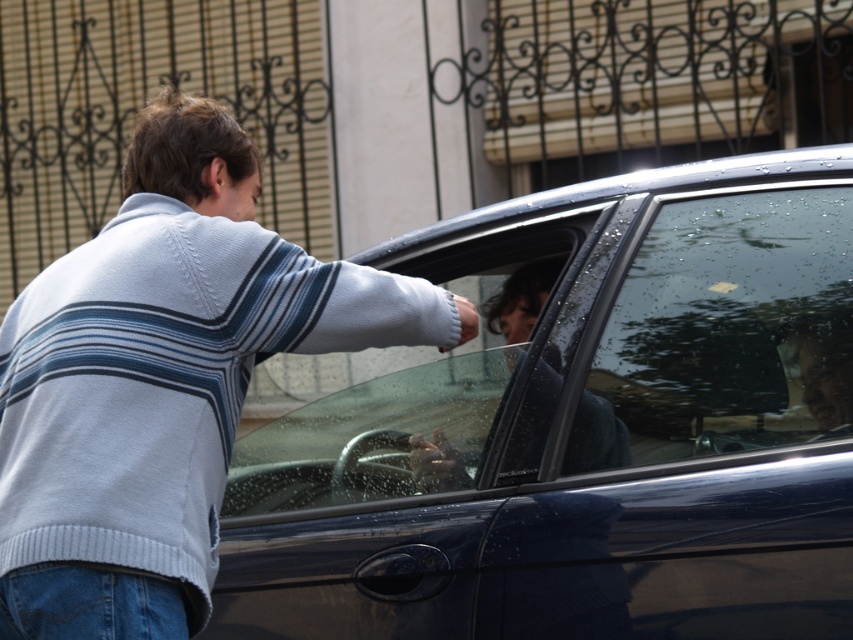
You are a delivery person standing in front of the glossy dark blue car at center and the light blue sweater at center. Which object is located to the right of the other?

The glossy dark blue car at center is positioned on the right side of light blue sweater at center.

You are a delivery person trying to hand a package to the driver through the transparent glass car window at center. To avoid hitting the transparent glass windshield at center, which direction should you move your arm?

The transparent glass windshield at center is located above the transparent glass car window at center, so you should move your arm downward to avoid hitting the windshield.